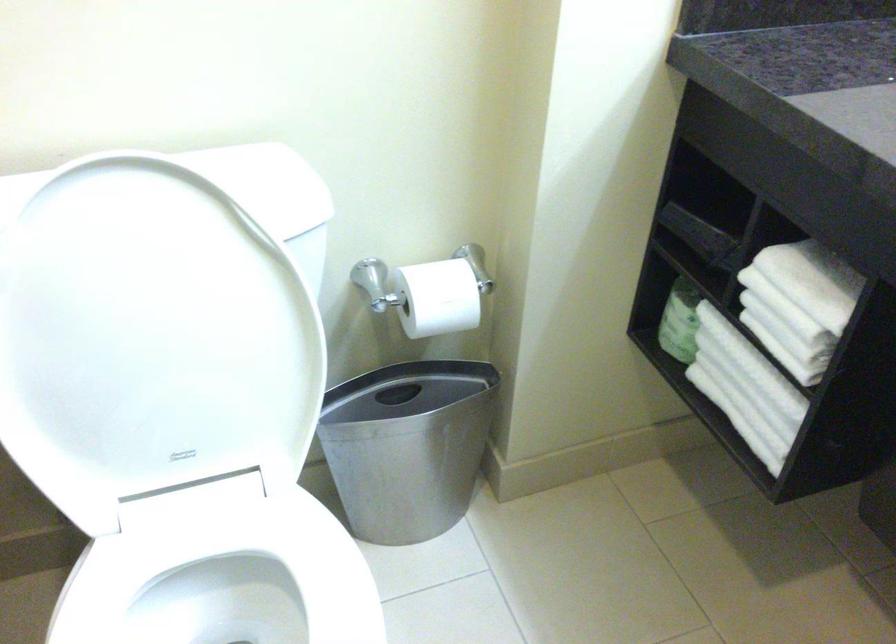
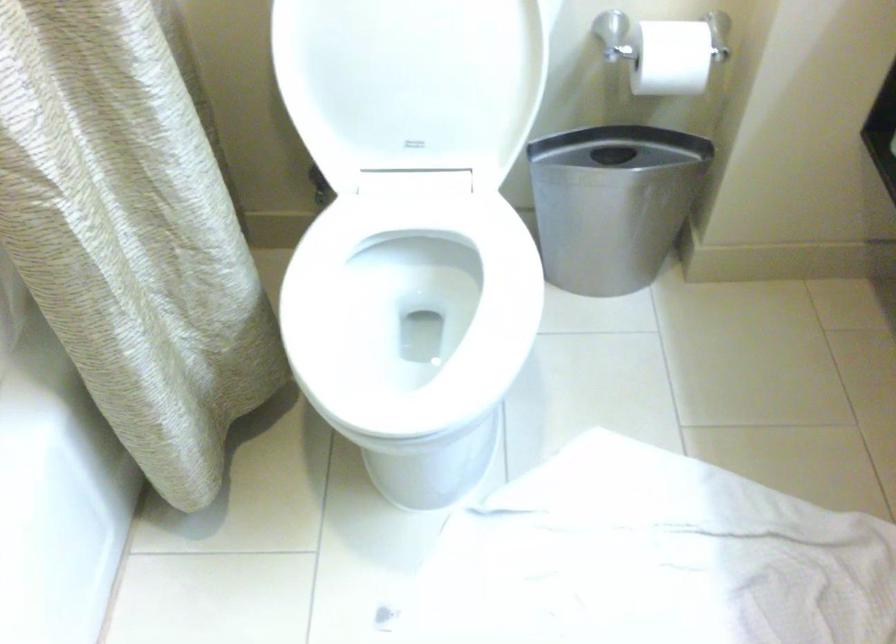
Question: The camera is either moving clockwise (left) or counter-clockwise (right) around the object. The first image is from the beginning of the video and the second image is from the end. Is the camera moving left or right when shooting the video?

Choices:
 (A) Left
 (B) Right

Answer: (B)